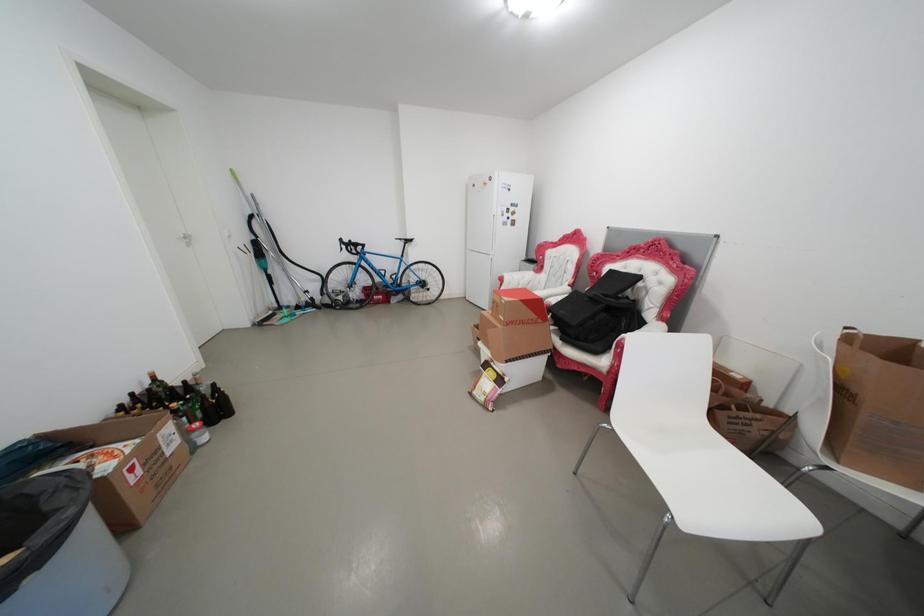
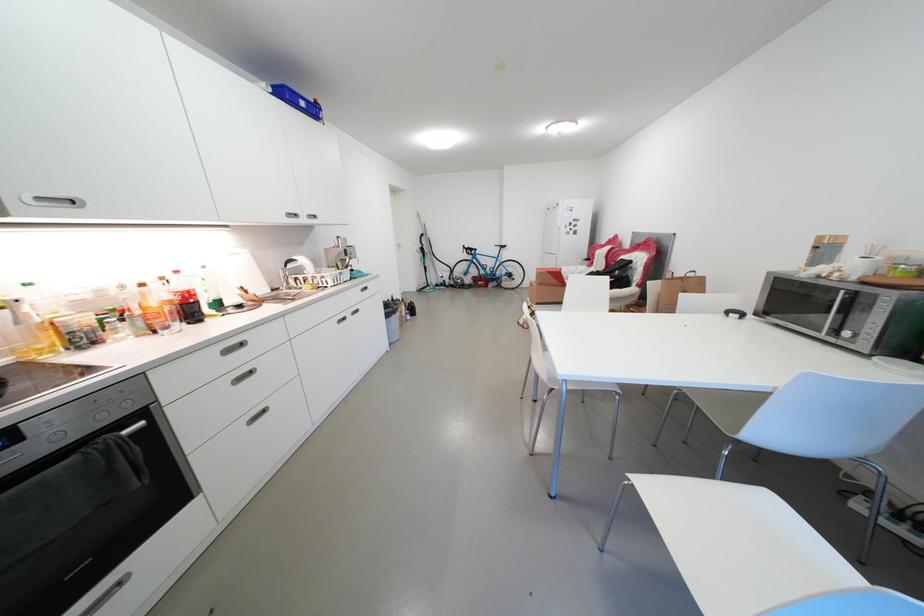
The images are taken continuously from a first-person perspective. In which direction are you moving?

The movement direction of the cameraman is right, backward.